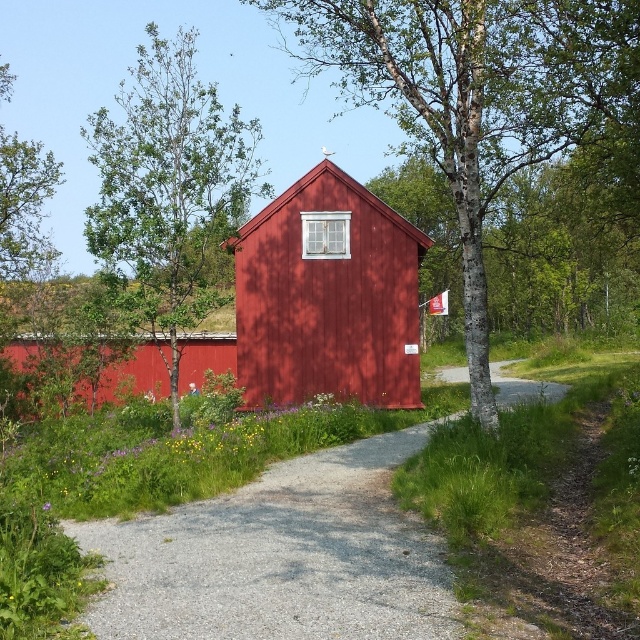
Question: Which object appears farthest from the camera in this image?

Choices:
 (A) matte wood hut at center
 (B) gravel path at center
 (C) bark textured tree at center

Answer: (A)

Question: Which object is farther from the camera taking this photo?

Choices:
 (A) bark textured tree at center
 (B) matte wood hut at center
 (C) green leafy tree at left

Answer: (B)

Question: Which point is farther from the camera taking this photo?

Choices:
 (A) (224, 216)
 (B) (417, 305)

Answer: (B)

Question: Is gravel path at center closer to the viewer compared to green leafy tree at left?

Choices:
 (A) yes
 (B) no

Answer: (A)

Question: Is bark textured tree at center wider than gravel path at center?

Choices:
 (A) no
 (B) yes

Answer: (B)

Question: Is bark textured tree at center in front of green leafy tree at left?

Choices:
 (A) yes
 (B) no

Answer: (A)